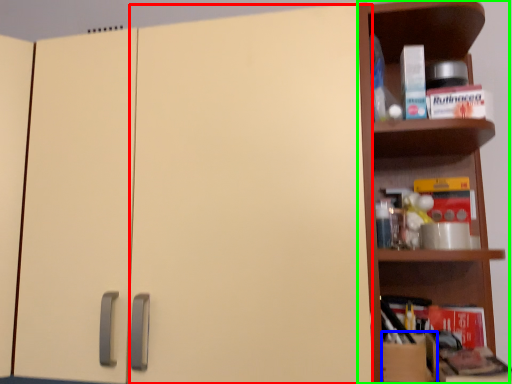
Question: Based on their relative distances, which object is farther from door (highlighted by a red box)? Choose from cardboard box (highlighted by a blue box) and shelf (highlighted by a green box).

Choices:
 (A) cardboard box
 (B) shelf

Answer: (A)